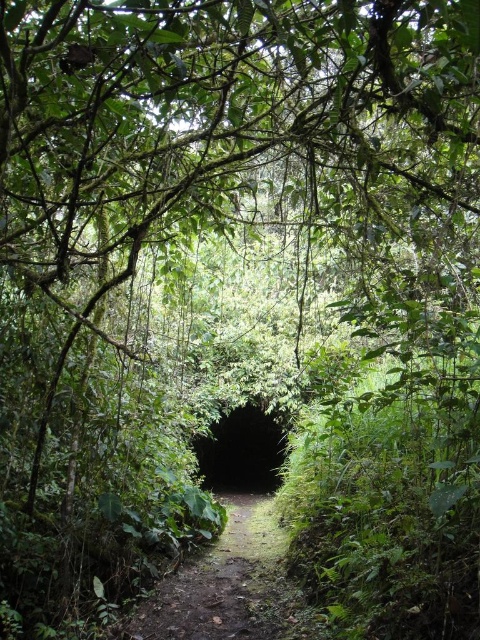
Between dirt path at center and black matte tunnel at center, which one appears on the right side from the viewer's perspective?

dirt path at center is more to the right.

Which of these two, dirt path at center or black matte tunnel at center, stands shorter?

dirt path at center

The height and width of the screenshot is (640, 480). Describe the element at coordinates (224, 584) in the screenshot. I see `dirt path at center` at that location.

Image resolution: width=480 pixels, height=640 pixels. In order to click on dirt path at center in this screenshot , I will do (224, 584).